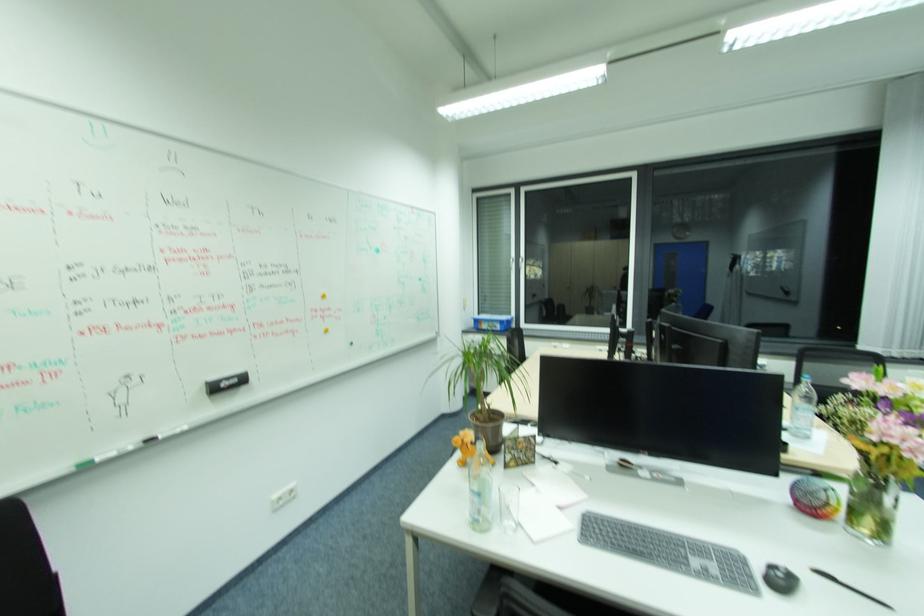
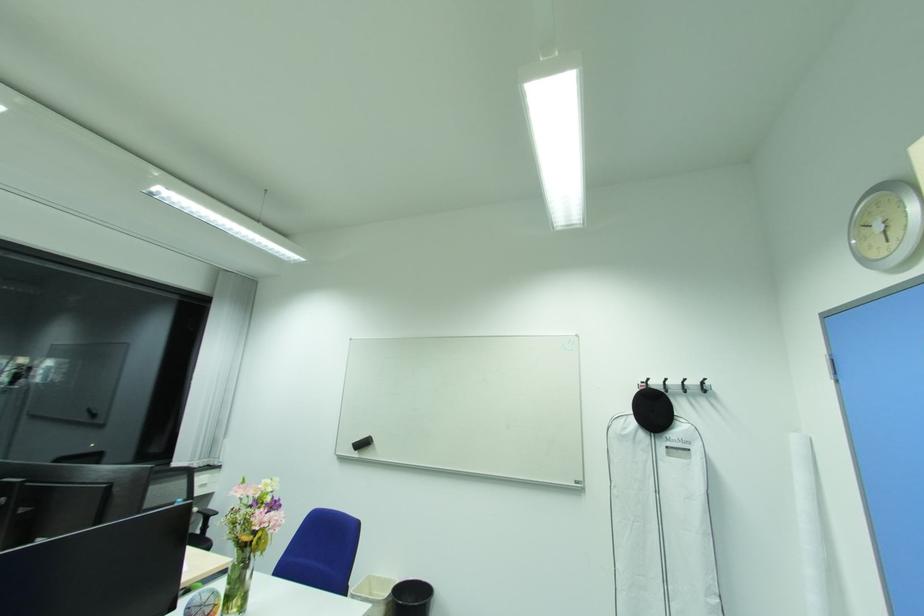
First-person continuous shooting, in which direction is the camera rotating?

The camera's rotation is toward right-up.